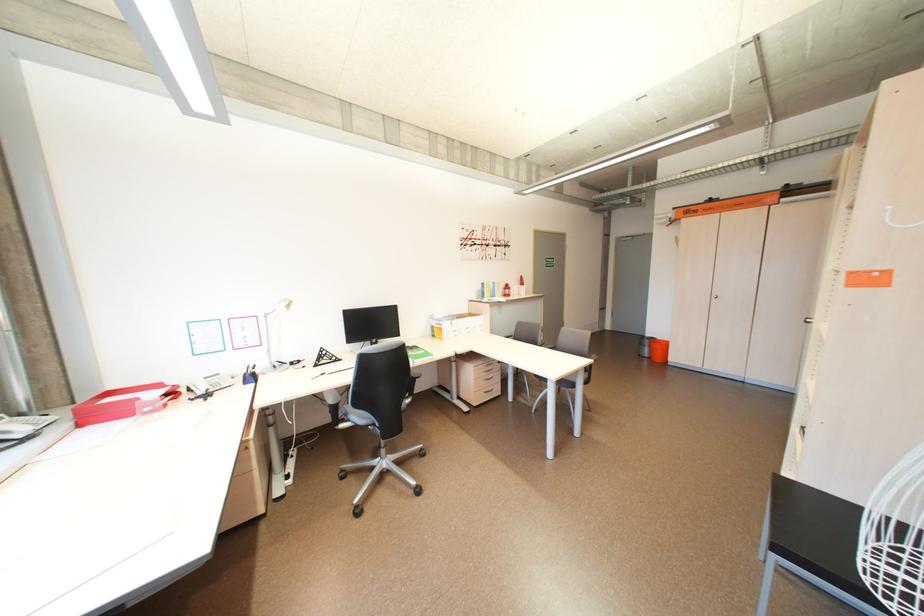
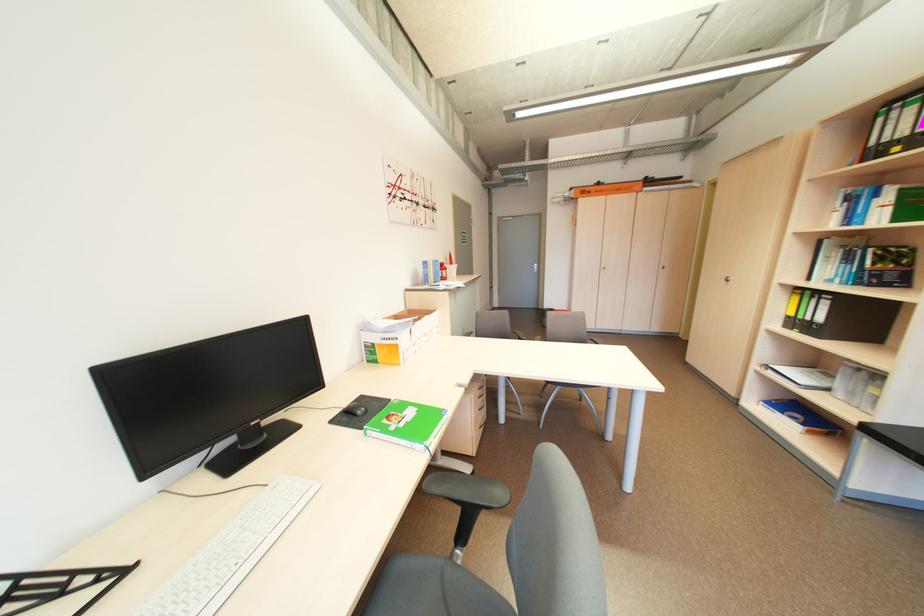
Question: I am providing you with two images of the same scene from different viewpoints. Please identify which objects are invisible in image2.

Choices:
 (A) black computer mouse
 (B) silver cabinet handle
 (C) yellow binder
 (D) none of these

Answer: (D)